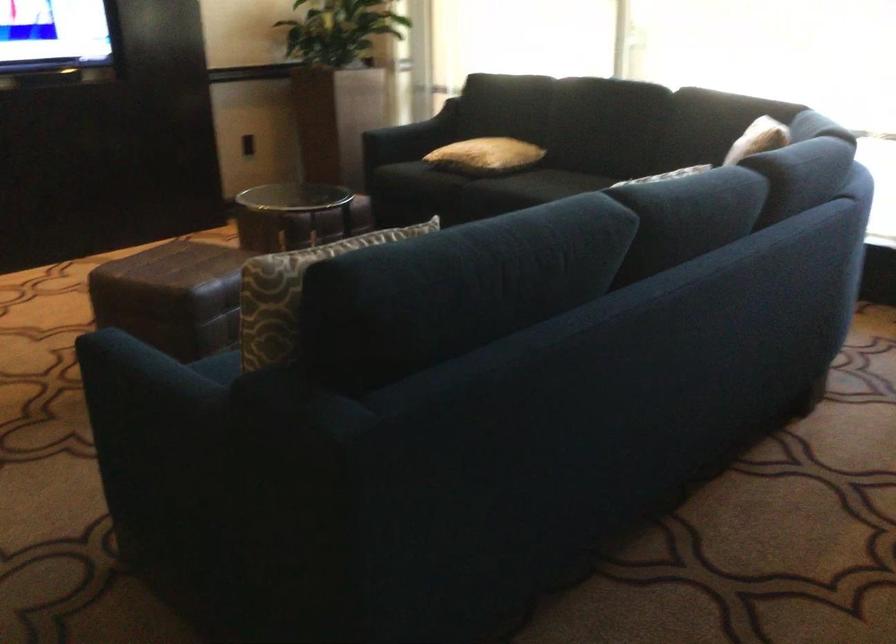
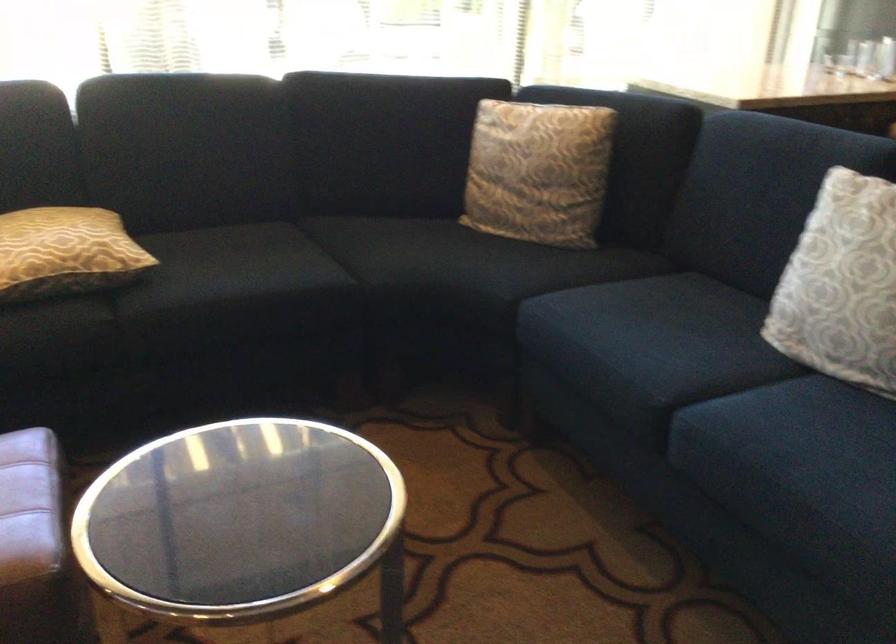
Locate, in the second image, the point that corresponds to [467,149] in the first image.

(65, 252)